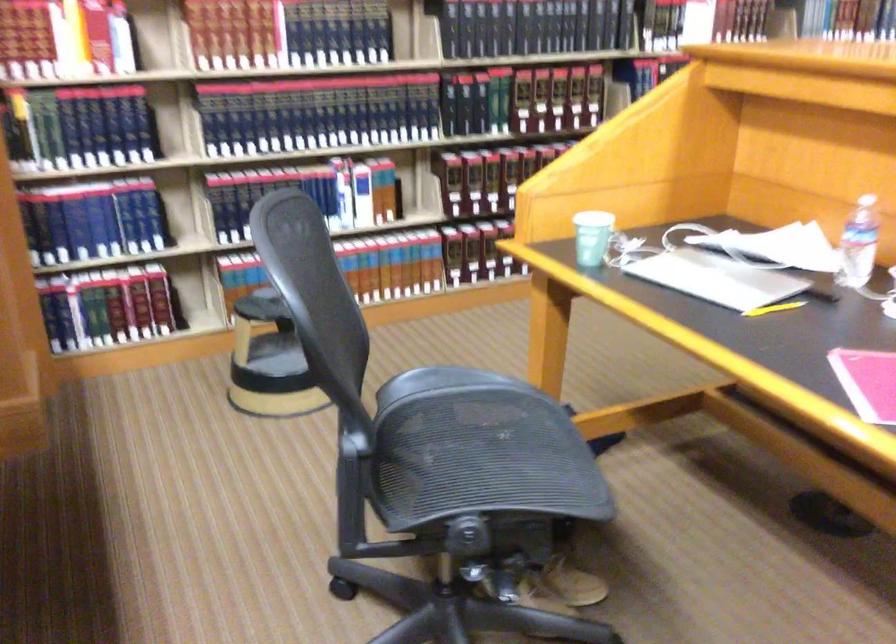
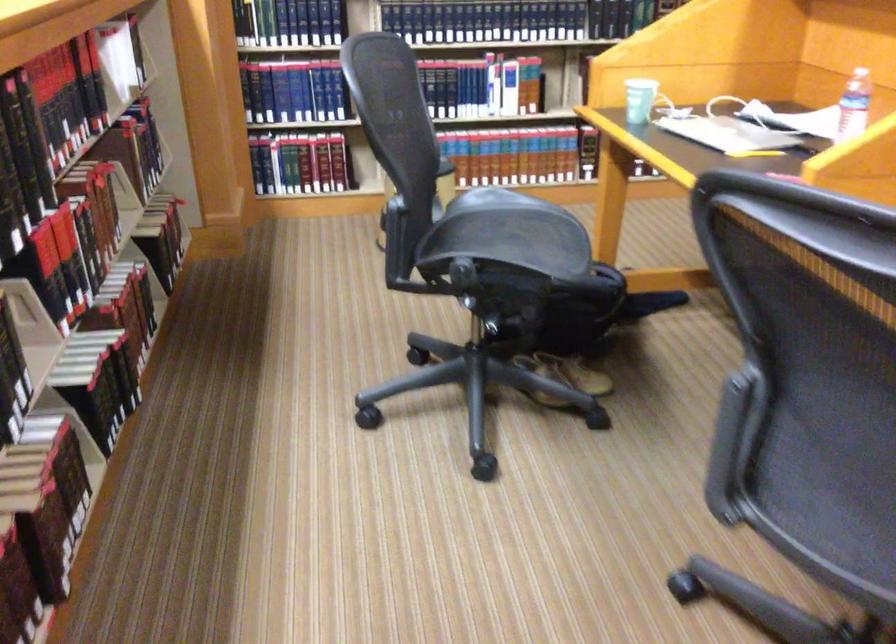
The point at (453,415) is marked in the first image. Where is the corresponding point in the second image?

(500, 221)